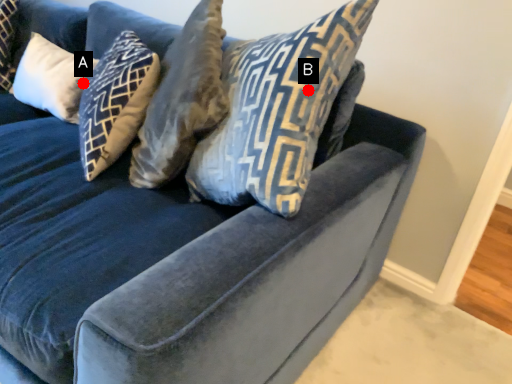
Question: Two points are circled on the image, labeled by A and B beside each circle. Which point is farther to the camera?

Choices:
 (A) A is further
 (B) B is further

Answer: (A)